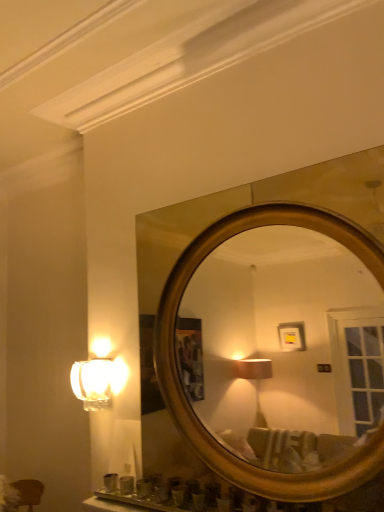
Question: Can matte glass lamp at left be found inside gold metallic mirror at upper center?

Choices:
 (A) no
 (B) yes

Answer: (A)

Question: From the image's perspective, does gold metallic mirror at upper center appear lower than matte glass lamp at left?

Choices:
 (A) no
 (B) yes

Answer: (A)

Question: Does gold metallic mirror at upper center have a greater height compared to matte glass lamp at left?

Choices:
 (A) no
 (B) yes

Answer: (B)

Question: Is gold metallic mirror at upper center positioned in front of matte glass lamp at left?

Choices:
 (A) yes
 (B) no

Answer: (A)

Question: Can you see gold metallic mirror at upper center touching matte glass lamp at left?

Choices:
 (A) yes
 (B) no

Answer: (B)

Question: Is gold metallic mirror at upper center shorter than matte glass lamp at left?

Choices:
 (A) no
 (B) yes

Answer: (A)

Question: Is matte glass lamp at left oriented away from gold metallic mirror at upper center?

Choices:
 (A) no
 (B) yes

Answer: (A)

Question: Can you confirm if matte glass lamp at left is thinner than gold metallic mirror at upper center?

Choices:
 (A) no
 (B) yes

Answer: (B)

Question: From a real-world perspective, is matte glass lamp at left below gold metallic mirror at upper center?

Choices:
 (A) no
 (B) yes

Answer: (B)

Question: From the image's perspective, is matte glass lamp at left over gold metallic mirror at upper center?

Choices:
 (A) yes
 (B) no

Answer: (B)

Question: Is the position of matte glass lamp at left more distant than that of gold metallic mirror at upper center?

Choices:
 (A) no
 (B) yes

Answer: (B)

Question: Is matte glass lamp at left smaller than gold metallic mirror at upper center?

Choices:
 (A) no
 (B) yes

Answer: (B)

Question: Is gold metallic mirror at upper center wider or thinner than matte glass lamp at left?

Choices:
 (A) wide
 (B) thin

Answer: (A)